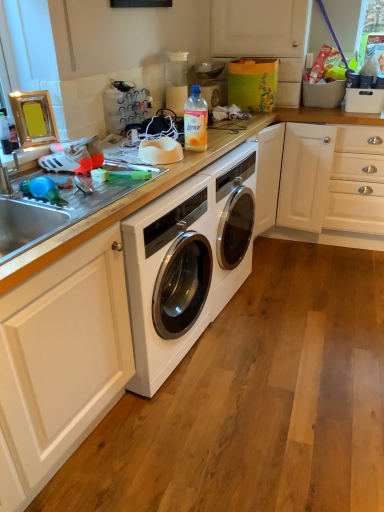
Question: Does white glossy countertop at center have a lesser height compared to matte white cabinet at upper right?

Choices:
 (A) yes
 (B) no

Answer: (B)

Question: From a real-world perspective, does white glossy countertop at center sit lower than matte white cabinet at upper right?

Choices:
 (A) no
 (B) yes

Answer: (B)

Question: From the image's perspective, is white glossy countertop at center under matte white cabinet at upper right?

Choices:
 (A) yes
 (B) no

Answer: (A)

Question: From the image's perspective, is white glossy countertop at center located above matte white cabinet at upper right?

Choices:
 (A) no
 (B) yes

Answer: (A)

Question: Is white glossy countertop at center looking in the opposite direction of matte white cabinet at upper right?

Choices:
 (A) yes
 (B) no

Answer: (B)

Question: Considering the relative positions of matte white cabinet at upper right and translucent plastic bottle at center in the image provided, is matte white cabinet at upper right to the left or to the right of translucent plastic bottle at center?

Choices:
 (A) left
 (B) right

Answer: (B)

Question: Do you think matte white cabinet at upper right is within translucent plastic bottle at center, or outside of it?

Choices:
 (A) outside
 (B) inside

Answer: (A)

Question: From the image's perspective, is matte white cabinet at upper right positioned above or below translucent plastic bottle at center?

Choices:
 (A) below
 (B) above

Answer: (B)

Question: Looking at their shapes, would you say matte white cabinet at upper right is wider or thinner than translucent plastic bottle at center?

Choices:
 (A) wide
 (B) thin

Answer: (A)

Question: Is white glossy countertop at center in front of or behind translucent plastic bottle at center in the image?

Choices:
 (A) behind
 (B) front

Answer: (A)

Question: Considering the positions of point (57, 237) and point (183, 113), is point (57, 237) closer or farther from the camera than point (183, 113)?

Choices:
 (A) closer
 (B) farther

Answer: (A)

Question: Do you think white glossy countertop at center is within translucent plastic bottle at center, or outside of it?

Choices:
 (A) outside
 (B) inside

Answer: (A)

Question: From the image's perspective, relative to translucent plastic bottle at center, is white glossy countertop at center above or below?

Choices:
 (A) above
 (B) below

Answer: (B)

Question: Relative to matte white cabinet at upper right, is translucent plastic bottle at center in front or behind?

Choices:
 (A) behind
 (B) front

Answer: (B)

Question: Choose the correct answer: Is translucent plastic bottle at center inside matte white cabinet at upper right or outside it?

Choices:
 (A) inside
 (B) outside

Answer: (B)